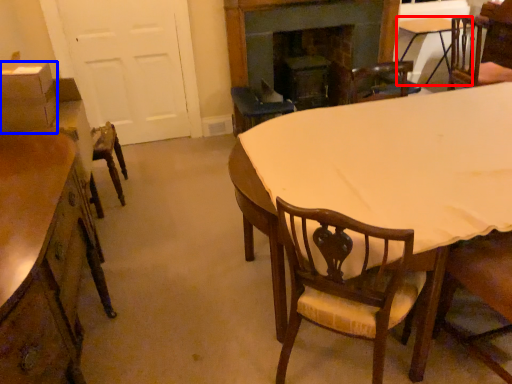
Question: Which object appears farthest to the camera in this image, table (highlighted by a red box) or box (highlighted by a blue box)?

Choices:
 (A) table
 (B) box

Answer: (A)